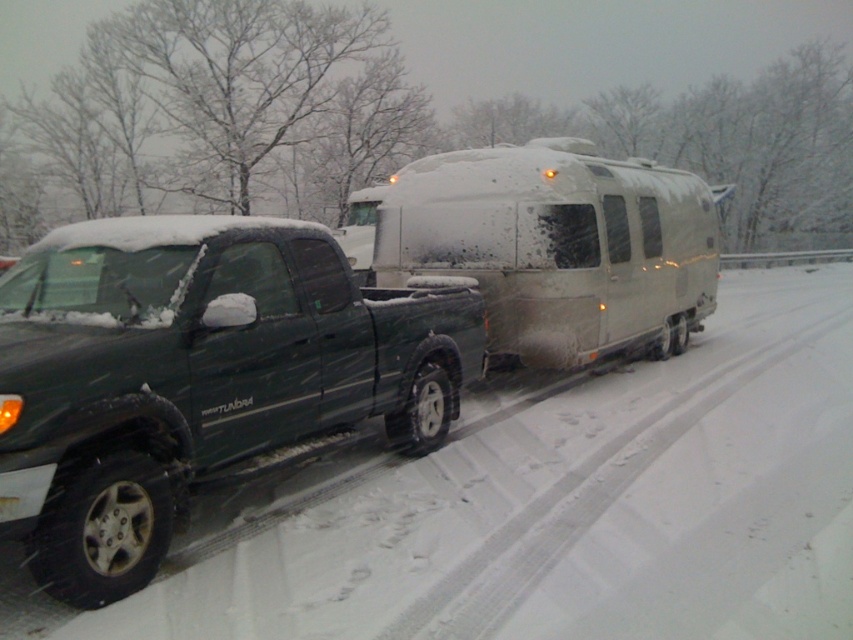
You are a delivery person trying to determine if your 6.5 feet tall package can fit between the matte black truck at left and the white matte trailer at center. Based on their heights, can the package be placed between them without tilting?

The matte black truck at left is not as tall as the white matte trailer at center. Since the package is 6.5 feet tall, and the shorter matte black truck at left is under that height, the package cannot be placed between them vertically without tilting.

You are a driver trying to navigate through the snow. The matte black truck at left is stuck in the snow. Can you use the white matte trailer at center to help pull it out?

The matte black truck at left is below the white matte trailer at center, so the trailer is positioned higher and could potentially be used to pull the truck out of the snow.

You are planning to park your vehicle in a narrow alley that can only accommodate one vehicle at a time. Given the space constraints, which vehicle should you park first to ensure both the matte black truck at left and the white matte trailer at center can fit into the alley?

Since the matte black truck at left occupies less space than the white matte trailer at center, you should park the matte black truck at left first to ensure both vehicles can fit into the narrow alley.